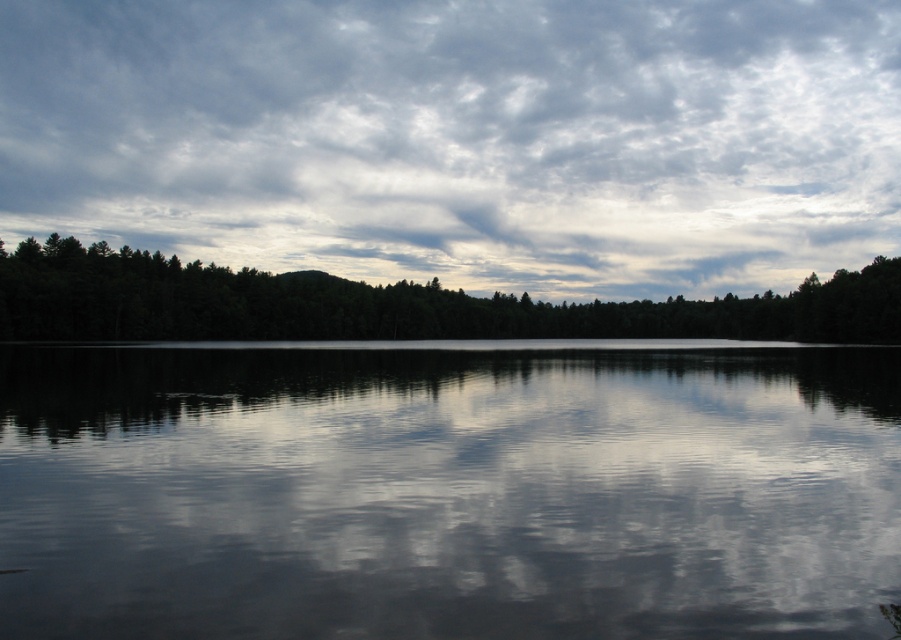
How far apart are smooth water at center and green matte forest at center?

smooth water at center and green matte forest at center are 388.08 feet apart.

Locate an element on the screen. Image resolution: width=901 pixels, height=640 pixels. smooth water at center is located at coordinates (447, 492).

You are a GUI agent. You are given a task and a screenshot of the screen. Output one action in this format:
    pyautogui.click(x=<x>, y=<y>)
    Task: Click on the smooth water at center
    The height and width of the screenshot is (640, 901).
    Given the screenshot: What is the action you would take?
    pyautogui.click(x=447, y=492)

From the picture: Can you confirm if smooth water at center is shorter than cloudy sky at upper center?

Indeed, smooth water at center has a lesser height compared to cloudy sky at upper center.

Who is lower down, smooth water at center or cloudy sky at upper center?

Positioned lower is smooth water at center.

Which is in front, point (497, 561) or point (380, 216)?

Positioned in front is point (497, 561).

Image resolution: width=901 pixels, height=640 pixels. In order to click on smooth water at center in this screenshot , I will do `click(447, 492)`.

Can you confirm if cloudy sky at upper center is smaller than green matte forest at center?

No, cloudy sky at upper center is not smaller than green matte forest at center.

Between point (530, 22) and point (754, 307), which one is positioned in front?

Point (754, 307) is in front.

Does point (26, 228) come behind point (83, 296)?

Yes.

Identify the location of cloudy sky at upper center. The width and height of the screenshot is (901, 640). (462, 138).